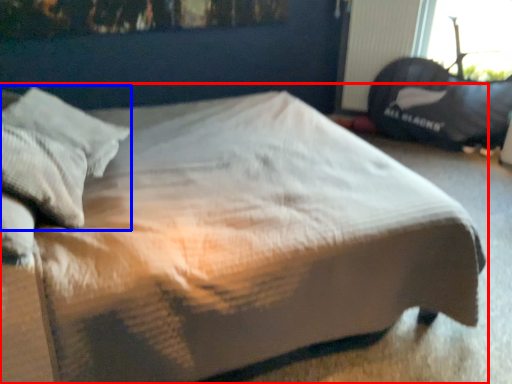
Question: Which point is closer to the camera, bed (highlighted by a red box) or pillow (highlighted by a blue box)?

Choices:
 (A) bed
 (B) pillow

Answer: (A)